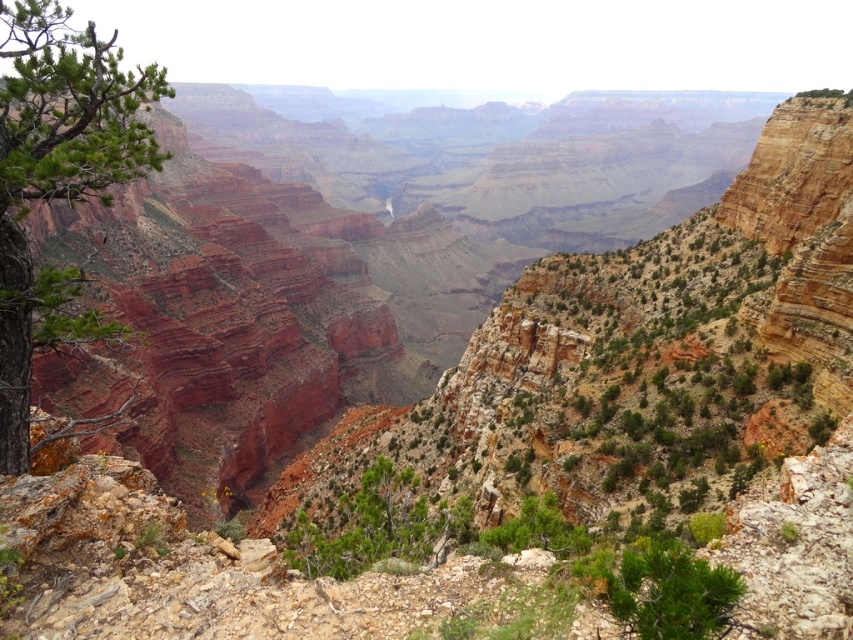
You are a hiker planning to take a photo of the Grand Canyon. You want to include both the green textured pine tree at left and the green matte tree at center in your shot. Which tree should you focus on to ensure both are in the frame?

The green textured pine tree at left is bigger than the green matte tree at center, so focusing on the larger tree will help ensure both are included in the frame.

You are a hiker standing at the edge of the Grand Canyon. You see a green matte tree at center and a green rough textured bush at lower right. Which of these two plants is closer to your left side?

The green matte tree at center is to the left of the green rough textured bush at lower right, so it is closer to your left side.

You are a photographer planning to capture the Grand Canyon landscape. You have a wide angle lens that can capture objects up to 3 meters wide. You notice the green matte tree at center and the green rough textured bush at lower right in your viewfinder. Which of these two objects will fit entirely within the lens if you focus on them individually?

The green rough textured bush at lower right will fit entirely within the lens since its width is smaller than the green matte tree at center, which is wider than the 3 meters capacity of the lens.